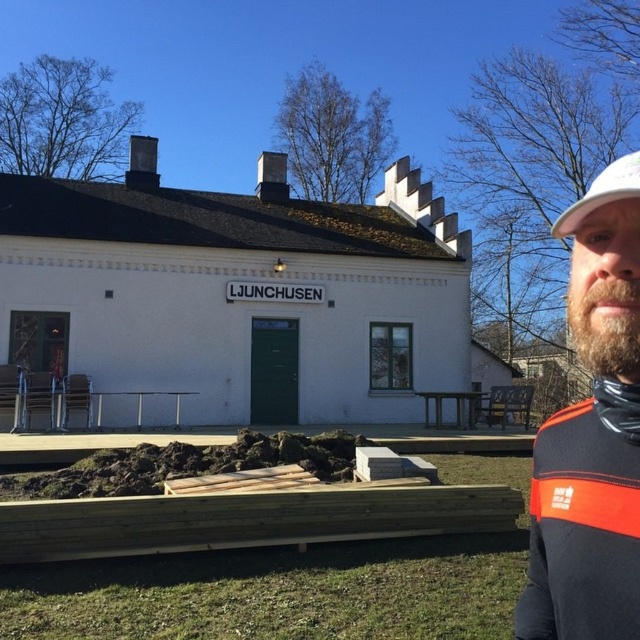
You are organizing a small outdoor event on the wooden platform in front of the building. You have a dark brown leather jacket at right and a white matte baseball cap at upper right. Which item takes up more space on the platform?

The white matte baseball cap at upper right takes up more space than the dark brown leather jacket at right.